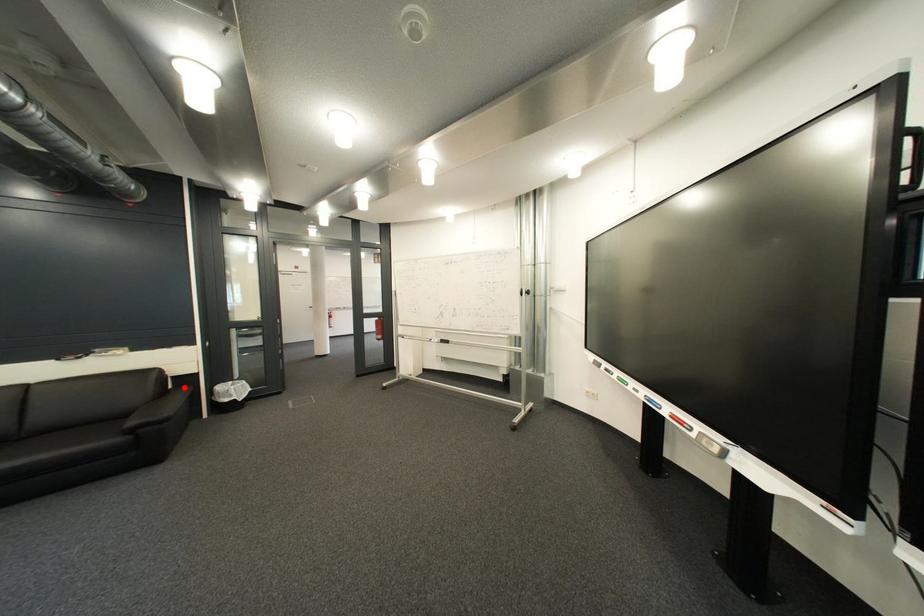
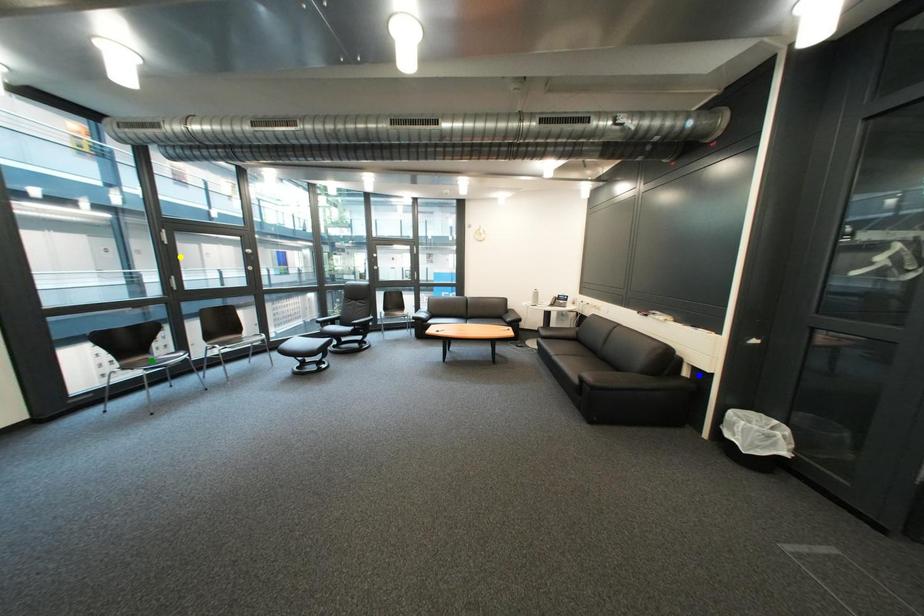
Question: I am providing you with two images of the same scene from different viewpoints. A red point is marked on the first image. You are given multiple points on the second image. Can you choose the point in image 2 that corresponds to the point in image 1?

Choices:
 (A) yellow point
 (B) blue point
 (C) green point

Answer: (B)